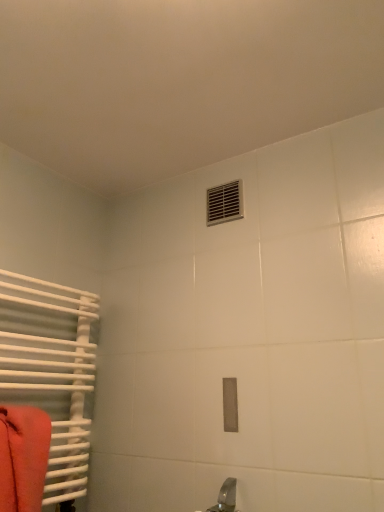
Question: In terms of width, does metallic silver vent at upper center look wider or thinner when compared to matte orange towel at left?

Choices:
 (A) wide
 (B) thin

Answer: (B)

Question: Would you say metallic silver vent at upper center is to the left or to the right of matte orange towel at left in the picture?

Choices:
 (A) right
 (B) left

Answer: (A)

Question: Which is nearer to the matte orange towel at left?

Choices:
 (A) white matte radiator at left
 (B) metallic silver vent at upper center

Answer: (A)

Question: Which object is positioned closest to the metallic silver vent at upper center?

Choices:
 (A) matte orange towel at left
 (B) white matte radiator at left

Answer: (B)